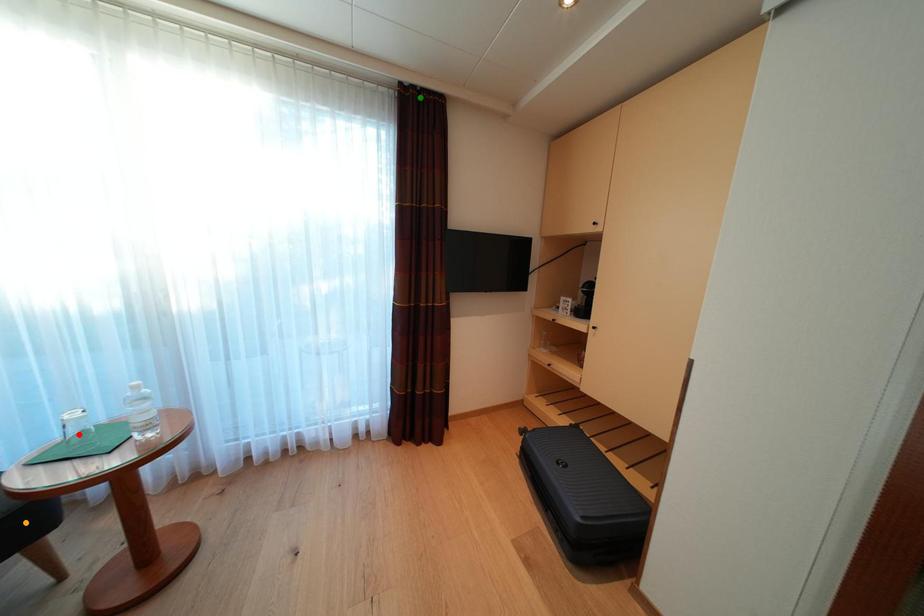
Order these from nearest to farthest:
green point | orange point | red point

orange point
red point
green point